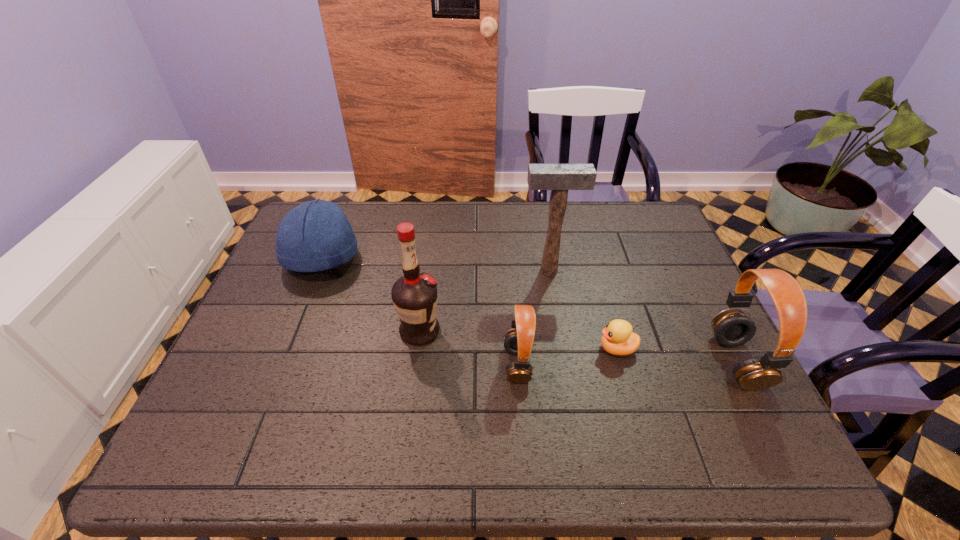
You are a GUI agent. You are given a task and a screenshot of the screen. Output one action in this format:
    pyautogui.click(x=<x>, y=<y>)
    Task: Click on the free point located 0.150m on the ear cups of the left headset
    The image size is (960, 540).
    Given the screenshot: What is the action you would take?
    pyautogui.click(x=439, y=364)

Locate an element on the screen. The width and height of the screenshot is (960, 540). vacant space located on the ear cups of the left headset is located at coordinates (400, 364).

The width and height of the screenshot is (960, 540). In order to click on vacant region located 0.180m on the front of the mallet in this screenshot , I will do `click(558, 325)`.

Identify the location of vacant space located 0.280m on the right of the skullcap. (455, 258).

Locate an element on the screen. vacant area situated 0.200m on the front and back of the second object from left to right is located at coordinates (522, 332).

Find the location of `vacant area situated on the face of the second object from right to left`. vacant area situated on the face of the second object from right to left is located at coordinates (459, 349).

I want to click on vacant position located on the face of the second object from right to left, so click(514, 349).

Locate an element on the screen. free spot located 0.090m on the face of the second object from right to left is located at coordinates (560, 349).

The image size is (960, 540). Identify the location of object located in the far edge section of the desktop. (316, 235).

I want to click on object at the left edge, so click(x=316, y=235).